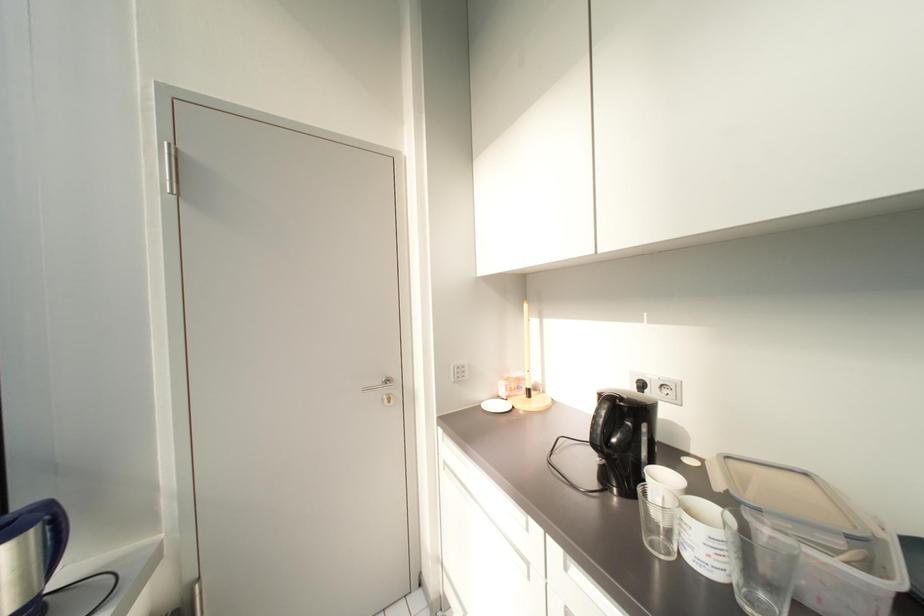
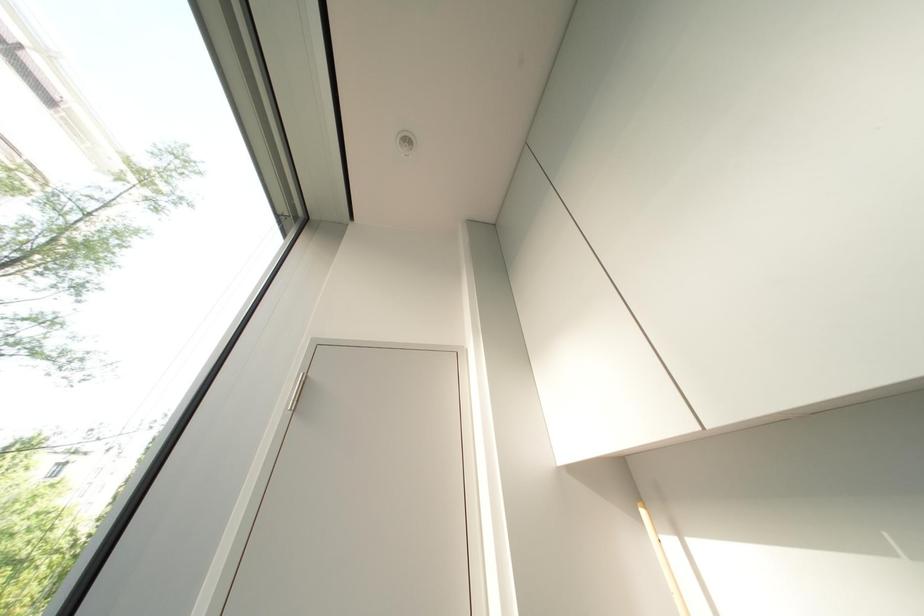
Based on the continuous images, in which direction is the camera rotating?

The camera's rotation is toward left-up.